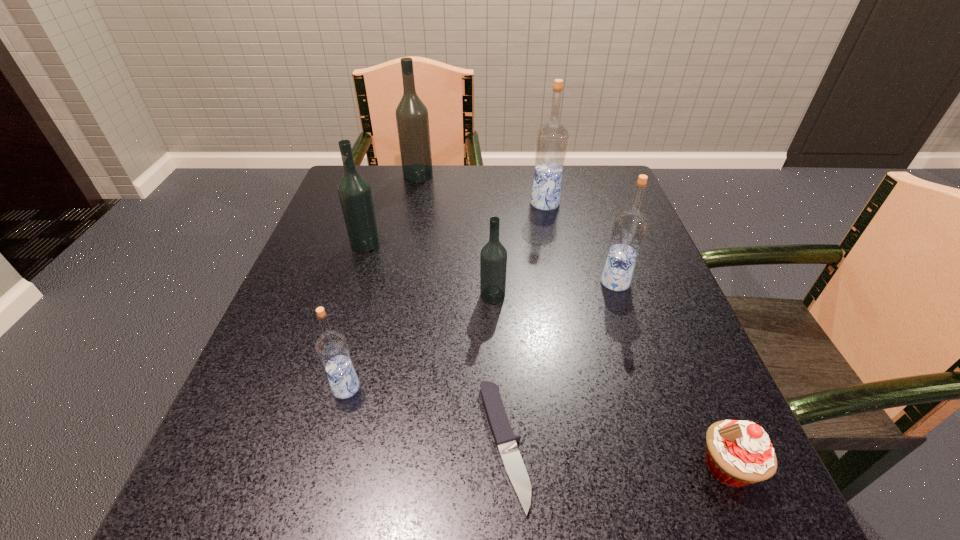
Locate an element on the screen. This screenshot has height=540, width=960. vacant space that is in between the second biggest blue vodka and the seventh tallest object is located at coordinates (671, 375).

Where is `free space between the second blue vodka from left to right and the fourth vodka from left to right`? free space between the second blue vodka from left to right and the fourth vodka from left to right is located at coordinates (518, 249).

Find the location of `free area in between the smallest black vodka and the second farthest black vodka`. free area in between the smallest black vodka and the second farthest black vodka is located at coordinates (429, 269).

At what (x,y) coordinates should I click in order to perform the action: click on vacant area between the third object from right to left and the nearest black vodka. Please return your answer as a coordinate pair (x, y). Looking at the image, I should click on (518, 249).

Choose which object is the seventh nearest neighbor to the second nearest blue vodka. Please provide its 2D coordinates. Your answer should be formatted as a tuple, i.e. [(x, y)], where the tuple contains the x and y coordinates of a point satisfying the conditions above.

[(412, 119)]

Point out which object is positioned as the nearest to the steak knife. Please provide its 2D coordinates. Your answer should be formatted as a tuple, i.e. [(x, y)], where the tuple contains the x and y coordinates of a point satisfying the conditions above.

[(493, 258)]

Locate an element on the screen. vodka that is the sixth closest one to the shortest object is located at coordinates (412, 119).

At what (x,y) coordinates should I click in order to perform the action: click on the closest vodka to the smallest black vodka. Please return your answer as a coordinate pair (x, y). The width and height of the screenshot is (960, 540). Looking at the image, I should click on (629, 228).

This screenshot has width=960, height=540. Find the location of `black vodka that is the closest one to the second nearest black vodka`. black vodka that is the closest one to the second nearest black vodka is located at coordinates (412, 119).

Choose which black vodka is the third nearest neighbor to the seventh nearest object. Please provide its 2D coordinates. Your answer should be formatted as a tuple, i.e. [(x, y)], where the tuple contains the x and y coordinates of a point satisfying the conditions above.

[(354, 191)]